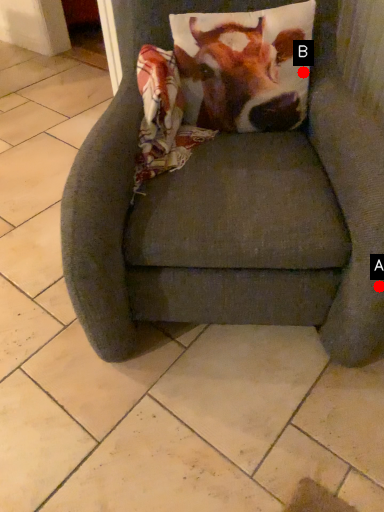
Question: Two points are circled on the image, labeled by A and B beside each circle. Which point is closer to the camera?

Choices:
 (A) A is closer
 (B) B is closer

Answer: (A)